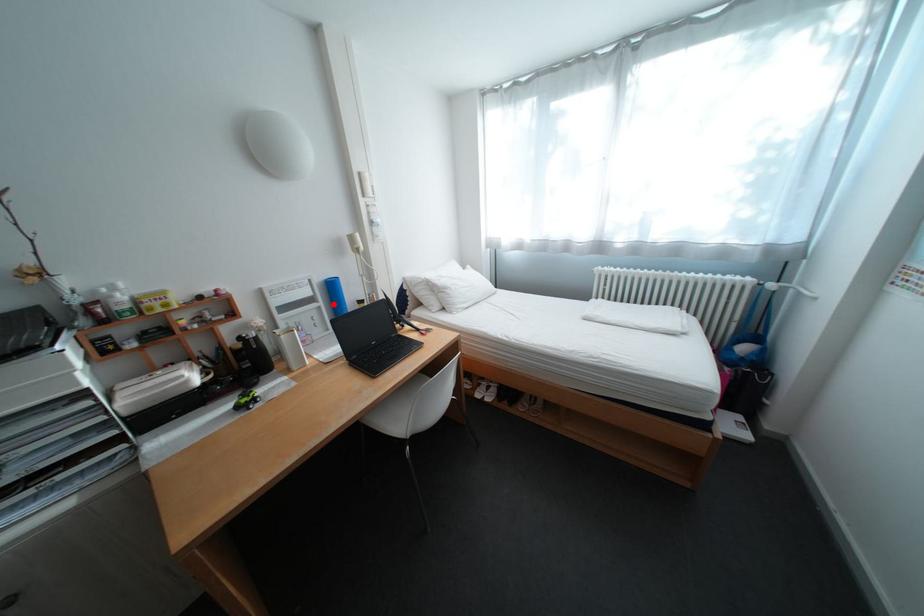
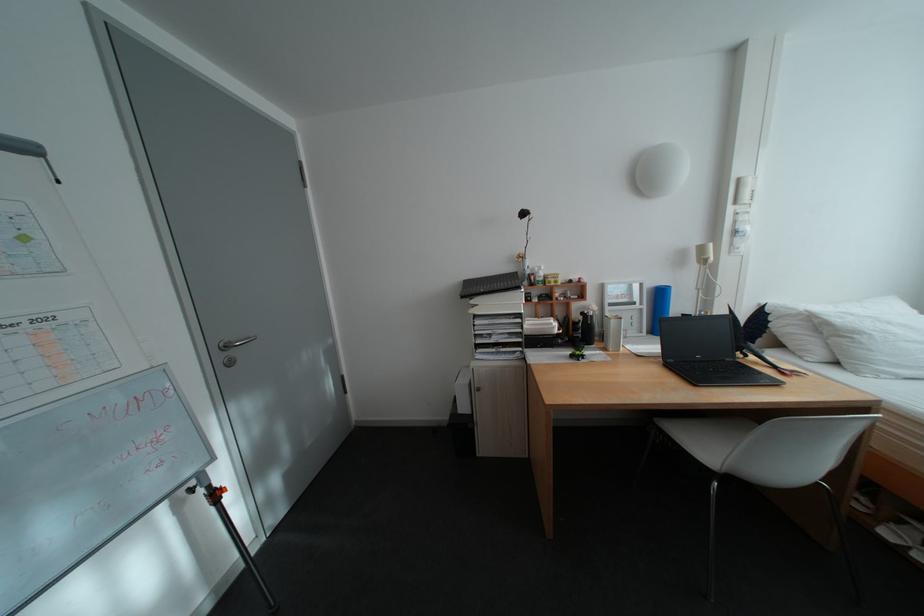
Question: I am providing you with two images of the same scene from different viewpoints. Given a red point in image1, look at the same physical point in image2. Is it:

Choices:
 (A) Closer to the viewpoint
 (B) Farther from the viewpoint

Answer: (B)